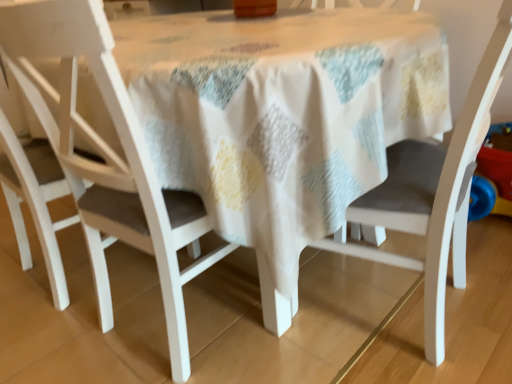
Question: Is white matte chair at left, positioned as the first chair in left-to-right order, looking in the opposite direction of matte white chair at center, the 2th chair in the right-to-left sequence?

Choices:
 (A) no
 (B) yes

Answer: (A)

Question: Does white matte chair at left, arranged as the third chair when viewed from the right, lie behind matte white chair at center, the second chair in the left-to-right sequence?

Choices:
 (A) no
 (B) yes

Answer: (B)

Question: From the image's perspective, would you say white matte chair at left, positioned as the first chair in left-to-right order, is shown under matte white chair at center, the second chair in the left-to-right sequence?

Choices:
 (A) no
 (B) yes

Answer: (A)

Question: Is there a large distance between white matte chair at left, positioned as the first chair in left-to-right order, and matte white chair at center, the 2th chair in the right-to-left sequence?

Choices:
 (A) yes
 (B) no

Answer: (B)

Question: Can you see white matte chair at left, positioned as the first chair in left-to-right order, touching matte white chair at center, the 2th chair in the right-to-left sequence?

Choices:
 (A) yes
 (B) no

Answer: (B)

Question: From a real-world perspective, is white matte chair at center, which is the 3th chair from left to right, above or below white matte chair at left, positioned as the first chair in left-to-right order?

Choices:
 (A) below
 (B) above

Answer: (A)

Question: Considering the positions of white matte chair at center, the first chair in the right-to-left sequence, and white matte chair at left, positioned as the first chair in left-to-right order, in the image, is white matte chair at center, the first chair in the right-to-left sequence, wider or thinner than white matte chair at left, positioned as the first chair in left-to-right order,?

Choices:
 (A) thin
 (B) wide

Answer: (B)

Question: From their relative heights in the image, would you say white matte chair at center, the first chair in the right-to-left sequence, is taller or shorter than white matte chair at left, arranged as the third chair when viewed from the right?

Choices:
 (A) tall
 (B) short

Answer: (B)

Question: In the image, is white matte chair at center, which is the 3th chair from left to right, positioned in front of or behind white matte chair at left, arranged as the third chair when viewed from the right?

Choices:
 (A) behind
 (B) front

Answer: (B)

Question: Is point (31, 258) positioned closer to the camera than point (178, 296)?

Choices:
 (A) closer
 (B) farther

Answer: (B)

Question: From the image's perspective, is white matte chair at left, positioned as the first chair in left-to-right order, positioned above or below matte white chair at center, the 2th chair in the right-to-left sequence?

Choices:
 (A) above
 (B) below

Answer: (A)

Question: In terms of height, does white matte chair at left, arranged as the third chair when viewed from the right, look taller or shorter compared to matte white chair at center, the second chair in the left-to-right sequence?

Choices:
 (A) tall
 (B) short

Answer: (B)

Question: Considering their positions, is white matte chair at left, positioned as the first chair in left-to-right order, located in front of or behind matte white chair at center, the 2th chair in the right-to-left sequence?

Choices:
 (A) behind
 (B) front

Answer: (A)

Question: From a real-world perspective, is matte white chair at center, the 2th chair in the right-to-left sequence, above or below white matte chair at left, arranged as the third chair when viewed from the right?

Choices:
 (A) below
 (B) above

Answer: (A)

Question: From the image's perspective, is matte white chair at center, the 2th chair in the right-to-left sequence, positioned above or below white matte chair at left, arranged as the third chair when viewed from the right?

Choices:
 (A) below
 (B) above

Answer: (A)